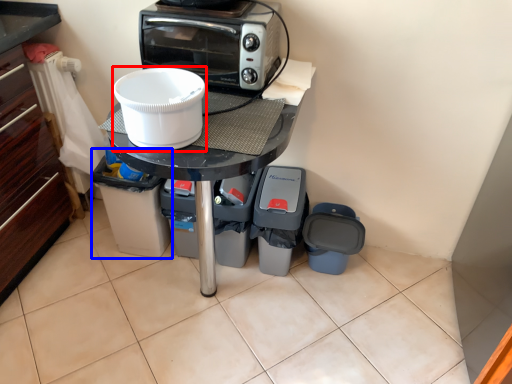
Question: Which object appears closest to the camera in this image, appliance (highlighted by a red box) or appliance (highlighted by a blue box)?

Choices:
 (A) appliance
 (B) appliance

Answer: (A)